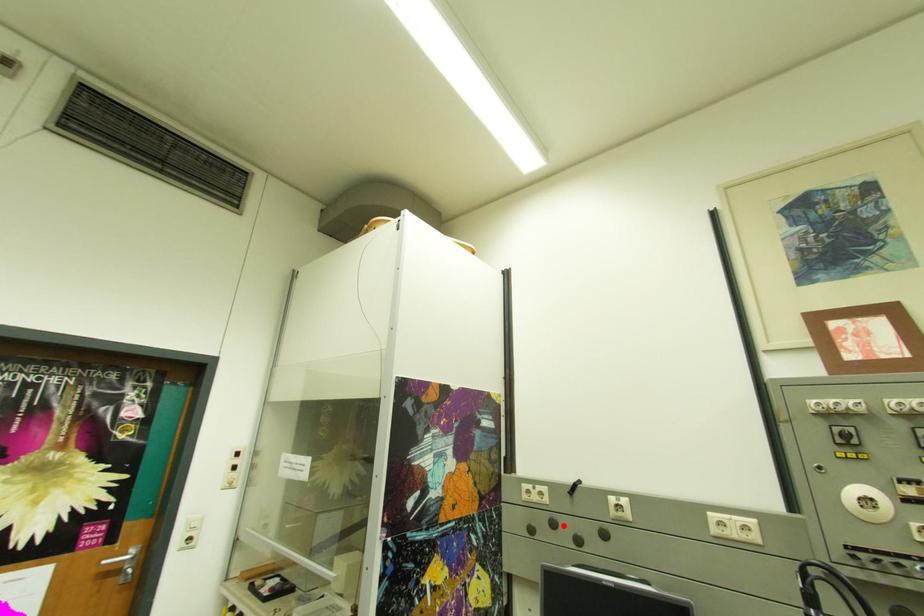
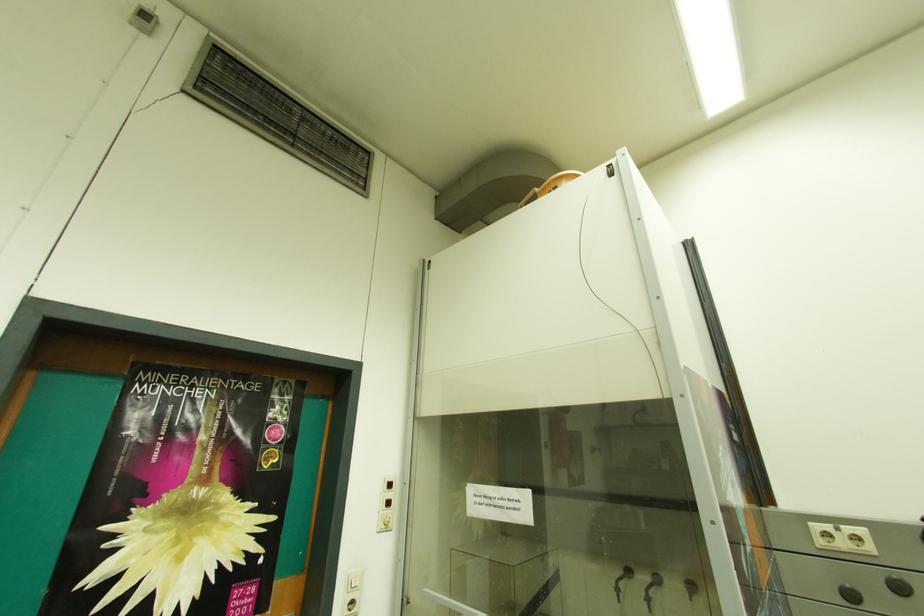
Question: A red point is marked in image1. In image2, is the corresponding 3D point closer to the camera or farther? Reply with the corresponding letter.

Choices:
 (A) The corresponding 3D point is closer.
 (B) The corresponding 3D point is farther.

Answer: (A)